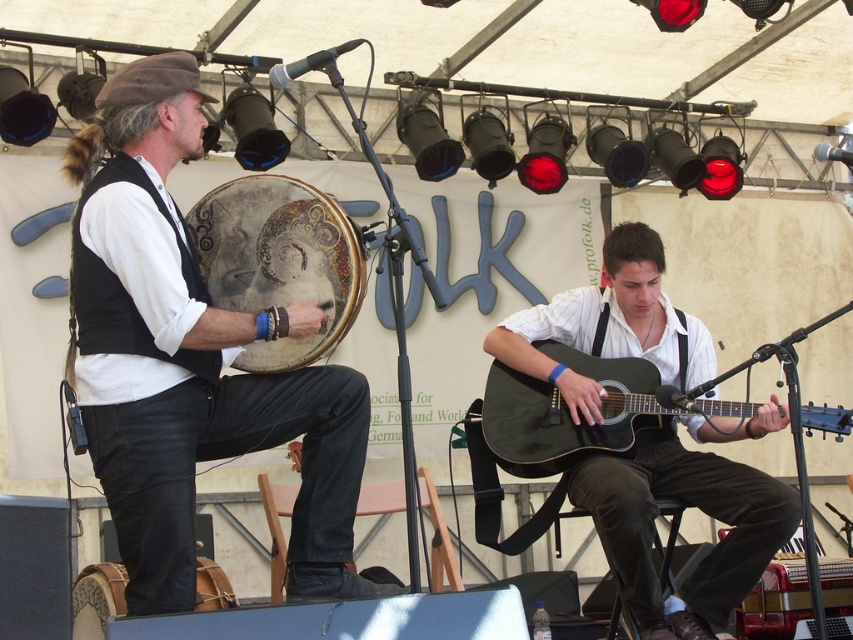
Is matte black drum at left bigger than matte black acoustic guitar at lower right?

Indeed, matte black drum at left has a larger size compared to matte black acoustic guitar at lower right.

Does matte black drum at left have a smaller size compared to matte black acoustic guitar at lower right?

No, matte black drum at left is not smaller than matte black acoustic guitar at lower right.

Between point (132, 454) and point (502, 392), which one is positioned in front?

Point (132, 454)

Find the location of a particular element. This screenshot has width=853, height=640. matte black drum at left is located at coordinates (190, 358).

Does matte black guitar at center appear under distressed leather drum at center?

Indeed, matte black guitar at center is positioned under distressed leather drum at center.

Does matte black guitar at center have a larger size compared to distressed leather drum at center?

Indeed, matte black guitar at center has a larger size compared to distressed leather drum at center.

Which is behind, point (627, 522) or point (277, 246)?

The point (627, 522) is more distant.

This screenshot has width=853, height=640. In order to click on matte black guitar at center in this screenshot , I will do `click(694, 506)`.

Who is shorter, matte black drum at left or matte black guitar at center?

Standing shorter between the two is matte black guitar at center.

Can you confirm if matte black drum at left is shorter than matte black guitar at center?

No, matte black drum at left is not shorter than matte black guitar at center.

This screenshot has width=853, height=640. I want to click on matte black drum at left, so click(190, 358).